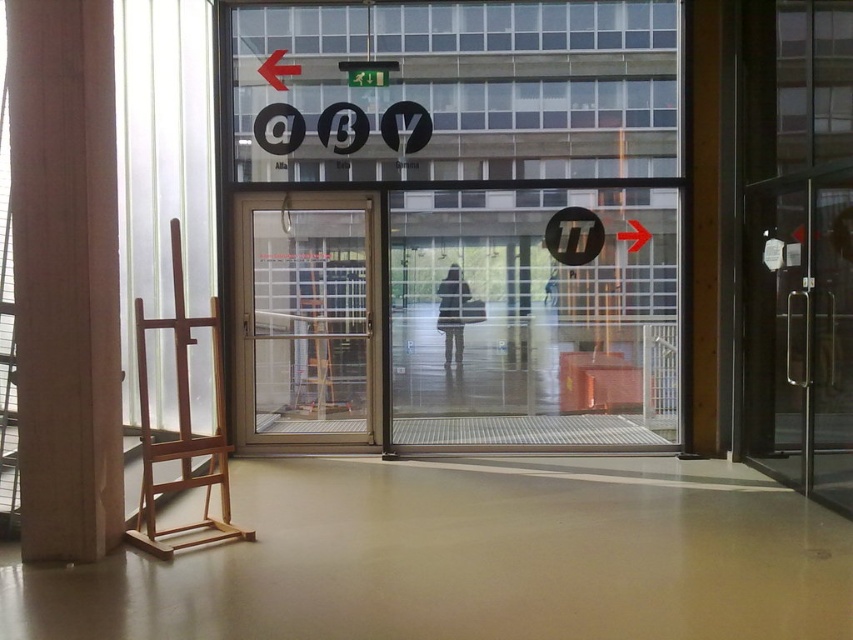
You are a delivery person carrying a package that requires you to go through the gold metallic door at center. However, the transparent glass arrow at right might block your path. Based on their sizes, can you pass through without moving the arrow?

The gold metallic door at center is much taller than the transparent glass arrow at right, so you can pass through without moving the arrow since the door is taller and likely provides enough space.

You are standing in the building entrance and see a red plastic arrow at upper left and a transparent glass arrow at right. Which arrow is closer to the left side of the entrance?

The red plastic arrow at upper left is closer to the left side of the entrance because it is positioned to the left of the transparent glass arrow at right.

From the picture: You are a delivery person carrying a large package and need to enter the building through the gold metallic door at center. However, there is a transparent glass arrow at right pointing towards the direction. Based on their positions, can you estimate whether the arrow is closer to you or further away than the door?

The gold metallic door at center is closer to the viewer than the transparent glass arrow at right, so the arrow is further away than the door.